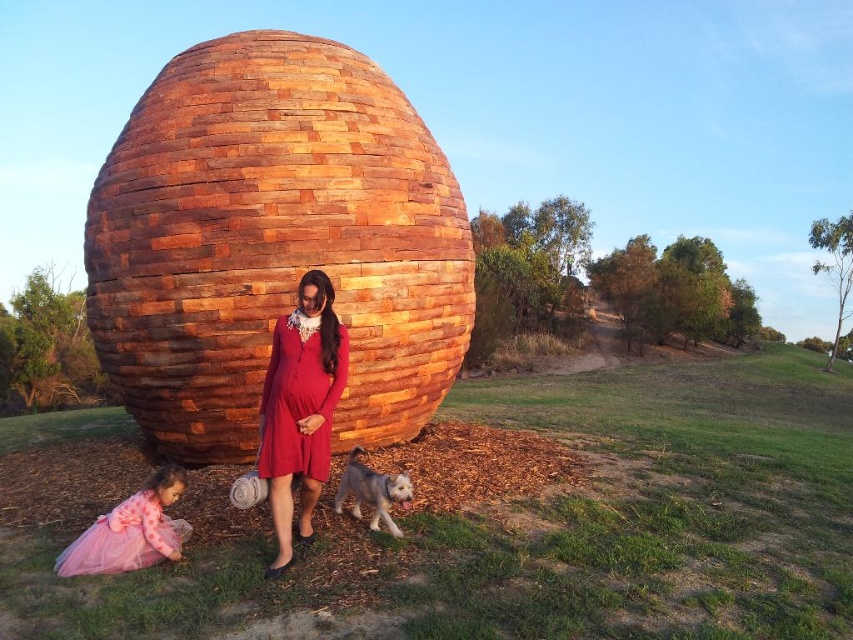
Question: Does matte red dress at center have a lesser width compared to white-furred dog at lower center?

Choices:
 (A) yes
 (B) no

Answer: (A)

Question: Can you confirm if pink tulle dress at lower left is wider than white-furred dog at lower center?

Choices:
 (A) no
 (B) yes

Answer: (B)

Question: Which point is farther to the camera?

Choices:
 (A) pink tulle dress at lower left
 (B) matte red dress at center
 (C) white-furred dog at lower center

Answer: (C)

Question: Considering the real-world distances, which object is farthest from the pink tulle dress at lower left?

Choices:
 (A) white-furred dog at lower center
 (B) matte red dress at center

Answer: (A)

Question: Is pink tulle dress at lower left above white-furred dog at lower center?

Choices:
 (A) yes
 (B) no

Answer: (B)

Question: Which is farther from the pink tulle dress at lower left?

Choices:
 (A) matte red dress at center
 (B) white-furred dog at lower center

Answer: (B)